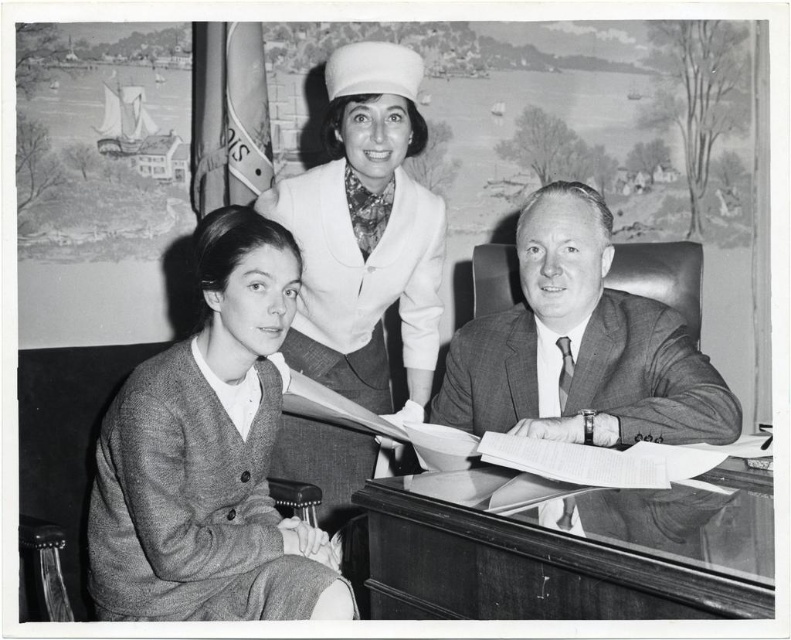
Can you confirm if textured gray cardigan at left is thinner than smooth gray suit at center?

Yes.

Between textured gray cardigan at left and smooth gray suit at center, which one is positioned higher?

smooth gray suit at center

You are a GUI agent. You are given a task and a screenshot of the screen. Output one action in this format:
    pyautogui.click(x=<x>, y=<y>)
    Task: Click on the textured gray cardigan at left
    The height and width of the screenshot is (640, 791).
    Given the screenshot: What is the action you would take?
    pyautogui.click(x=209, y=456)

You are a GUI agent. You are given a task and a screenshot of the screen. Output one action in this format:
    pyautogui.click(x=<x>, y=<y>)
    Task: Click on the textured gray cardigan at left
    The height and width of the screenshot is (640, 791).
    Given the screenshot: What is the action you would take?
    (x=209, y=456)

Does textured gray cardigan at left have a greater height compared to transparent glass table at center?

Correct, textured gray cardigan at left is much taller as transparent glass table at center.

Who is lower down, textured gray cardigan at left or transparent glass table at center?

transparent glass table at center is below.

Who is more distant from viewer, [110,458] or [472,552]?

The point [110,458] is more distant.

In order to click on textured gray cardigan at left in this screenshot , I will do (209, 456).

Does textured gray cardigan at left appear under smooth white hat at upper center?

Correct, textured gray cardigan at left is located below smooth white hat at upper center.

Identify the location of textured gray cardigan at left. This screenshot has height=640, width=791. (209, 456).

Find the location of `textured gray cardigan at left`. textured gray cardigan at left is located at coordinates (209, 456).